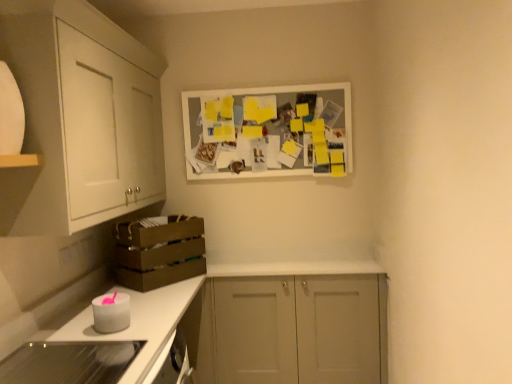
Find the location of a particular element. This screenshot has height=384, width=512. free space in front of brown cardboard crate at lower left is located at coordinates (161, 294).